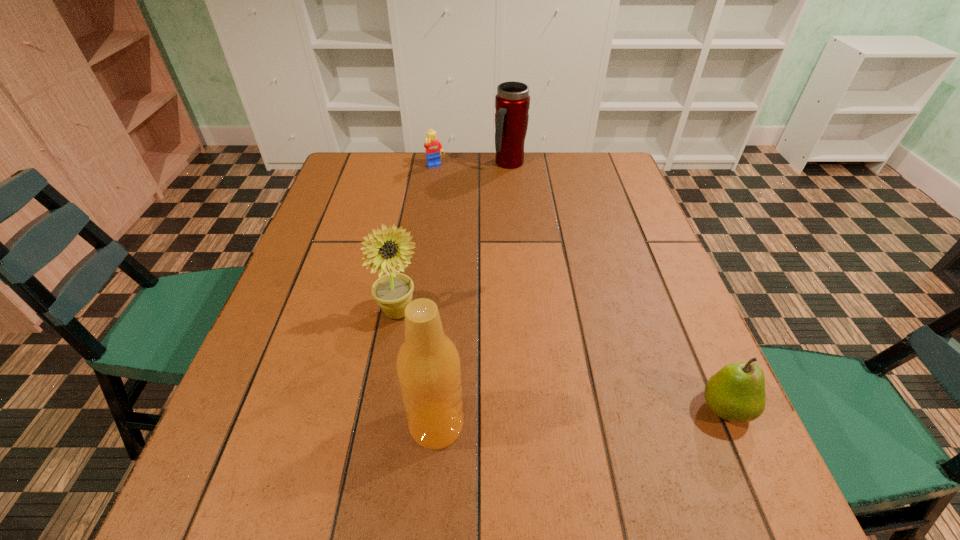
The height and width of the screenshot is (540, 960). What are the coordinates of `empty space between the beer bottle and the Lego` in the screenshot? It's located at (436, 296).

You are a GUI agent. You are given a task and a screenshot of the screen. Output one action in this format:
    pyautogui.click(x=<x>, y=<y>)
    Task: Click on the free spot between the rightmost object and the thermos bottle
    
    Given the screenshot: What is the action you would take?
    pyautogui.click(x=617, y=286)

At what (x,y) coordinates should I click in order to perform the action: click on empty location between the beer bottle and the thermos bottle. Please return your answer as a coordinate pair (x, y). This screenshot has height=540, width=960. Looking at the image, I should click on (473, 294).

Where is `free space between the rightmost object and the beer bottle`? The width and height of the screenshot is (960, 540). free space between the rightmost object and the beer bottle is located at coordinates (581, 416).

I want to click on empty location between the Lego and the pear, so click(581, 287).

The height and width of the screenshot is (540, 960). I want to click on free space between the Lego and the fourth object from left to right, so click(472, 165).

You are a GUI agent. You are given a task and a screenshot of the screen. Output one action in this format:
    pyautogui.click(x=<x>, y=<y>)
    Task: Click on the third closest object to the tallest object
    This screenshot has height=540, width=960.
    Given the screenshot: What is the action you would take?
    pyautogui.click(x=512, y=102)

Locate which object ranks fourth in proximity to the sunflower. Please provide its 2D coordinates. Your answer should be formatted as a tuple, i.e. [(x, y)], where the tuple contains the x and y coordinates of a point satisfying the conditions above.

[(512, 102)]

Find the location of `free space that satisfies the following two spatial constraints: 1. on the back side of the Lego; 2. on the right side of the third farthest object`. free space that satisfies the following two spatial constraints: 1. on the back side of the Lego; 2. on the right side of the third farthest object is located at coordinates (425, 167).